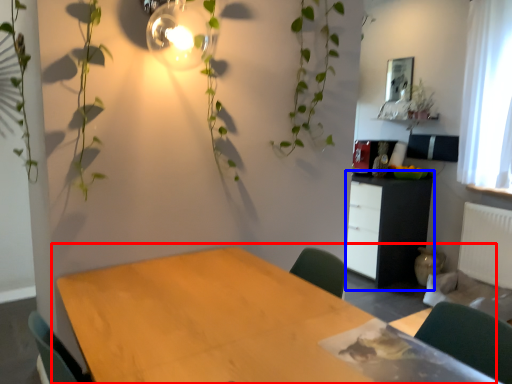
Question: Which object appears closest to the camera in this image, table (highlighted by a red box) or cabinetry (highlighted by a blue box)?

Choices:
 (A) table
 (B) cabinetry

Answer: (A)